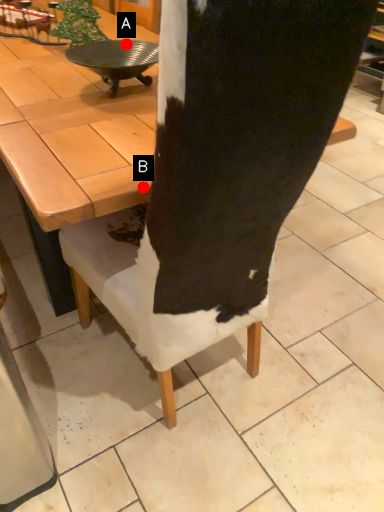
Question: Two points are circled on the image, labeled by A and B beside each circle. Which point is farther to the camera?

Choices:
 (A) A is further
 (B) B is further

Answer: (A)